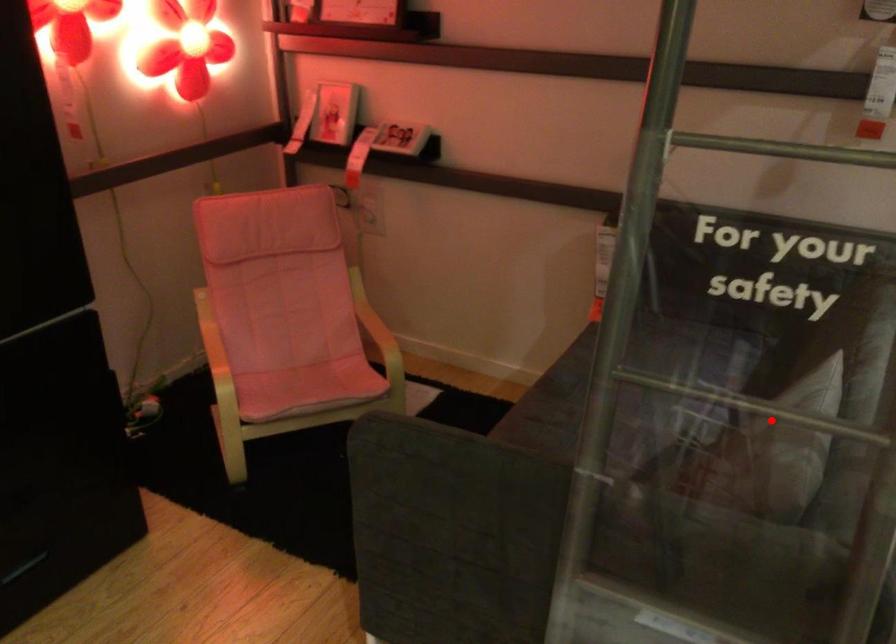
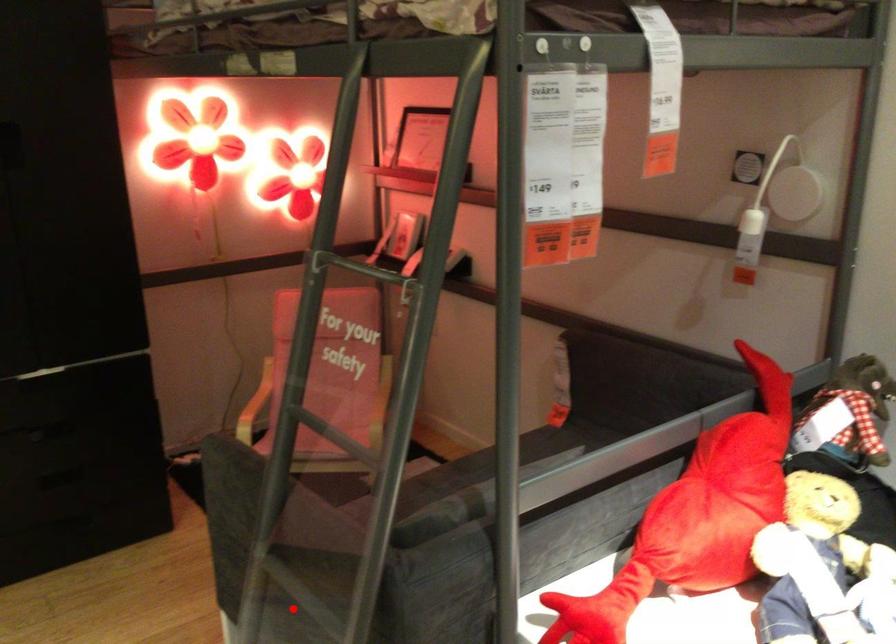
Based on the photo, I am providing you with two images of the same scene from different viewpoints. A red point is marked on the first image and another point is marked on the second image. Are the points marked in image1 and image2 representing the same 3D position?

No